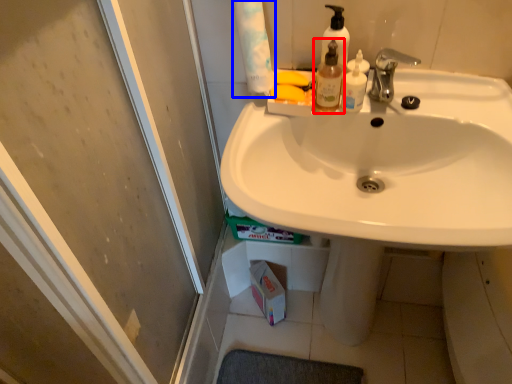
Question: Which of the following is the closest to the observer, mouthwash (highlighted by a red box) or toilet paper (highlighted by a blue box)?

Choices:
 (A) mouthwash
 (B) toilet paper

Answer: (B)